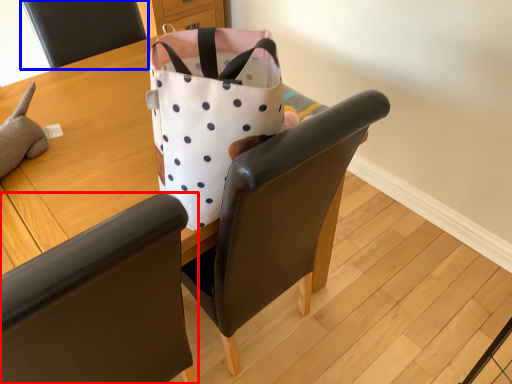
Question: Which point is closer to the camera, chair (highlighted by a red box) or chair (highlighted by a blue box)?

Choices:
 (A) chair
 (B) chair

Answer: (A)